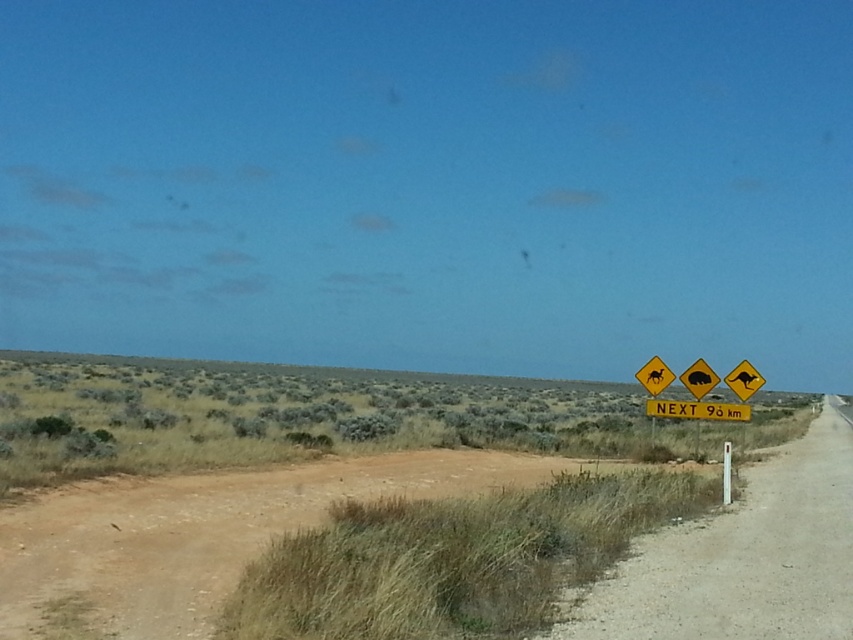
You are standing at the point with coordinates point (822, 506) and want to walk towards the point with coordinates point (724, 477). Which direction should you face to walk directly towards it?

You should face towards the upper left direction because point (724, 477) is located above and to the left of point (822, 506).